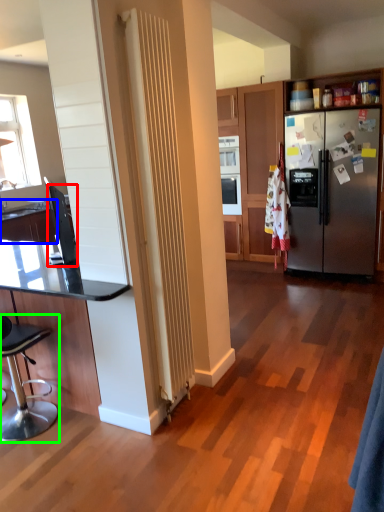
Question: Considering the real-world distances, which object is closest to appliance (highlighted by a red box)? countertop (highlighted by a blue box) or chair (highlighted by a green box).

Choices:
 (A) countertop
 (B) chair

Answer: (A)